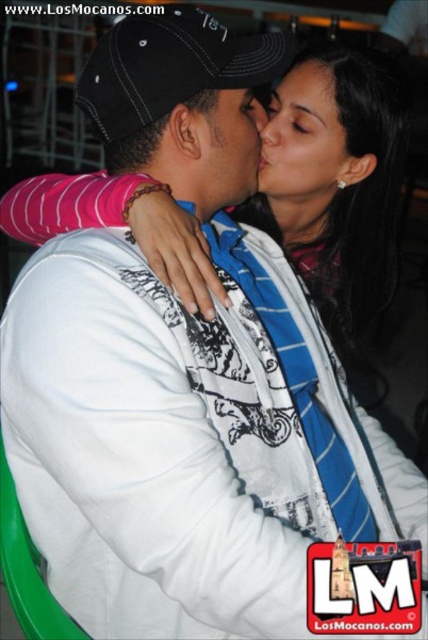
Question: Among these points, which one is nearest to the camera?

Choices:
 (A) (220, 205)
 (B) (329, 76)

Answer: (A)

Question: Which point appears closest to the camera in this image?

Choices:
 (A) (323, 68)
 (B) (247, 180)
 (C) (327, 77)

Answer: (B)

Question: Which point is closer to the camera?

Choices:
 (A) matte black cap at center
 (B) smooth skin forehead at upper center
 (C) smooth skin face at center

Answer: (A)

Question: From the image, what is the correct spatial relationship of smooth skin face at center in relation to matte black cap at center?

Choices:
 (A) right
 (B) left

Answer: (A)

Question: Does smooth skin face at center lie behind smooth skin forehead at upper center?

Choices:
 (A) no
 (B) yes

Answer: (B)

Question: Does matte black cap at center appear over smooth skin forehead at upper center?

Choices:
 (A) no
 (B) yes

Answer: (A)